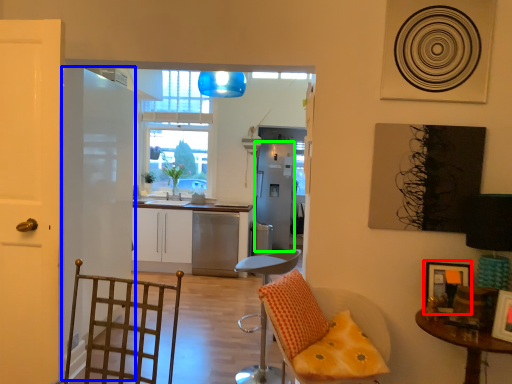
Question: Which object is positioned farthest from picture frame (highlighted by a red box)? Select from door (highlighted by a blue box) and appliance (highlighted by a green box).

Choices:
 (A) door
 (B) appliance

Answer: (B)